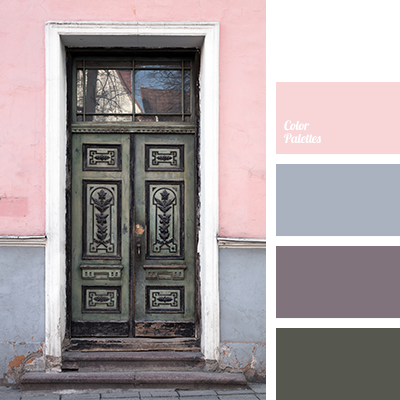
Find the location of a particular element. Image resolution: width=400 pixels, height=400 pixels. astragal is located at coordinates tap(131, 184), tap(131, 318).